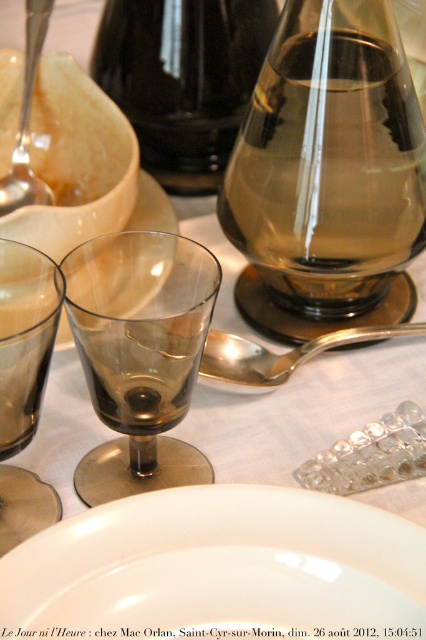
Is amber glass wine glass at center positioned behind white glossy platter at center?

Yes, amber glass wine glass at center is behind white glossy platter at center.

Does point (333, 42) come farther from viewer compared to point (273, 564)?

Yes, point (333, 42) is behind point (273, 564).

Is point (290, 3) in front of point (267, 496)?

No, (290, 3) is further to viewer.

You are a GUI agent. You are given a task and a screenshot of the screen. Output one action in this format:
    pyautogui.click(x=<x>, y=<y>)
    Task: Click on the amber glass wine glass at center
    
    Given the screenshot: What is the action you would take?
    pyautogui.click(x=328, y=173)

Does amber glass wine glass at center appear on the left side of brown glass at center?

Incorrect, amber glass wine glass at center is not on the left side of brown glass at center.

Is the position of amber glass wine glass at center more distant than that of brown glass at center?

Yes.

At what (x,y) coordinates should I click in order to perform the action: click on amber glass wine glass at center. Please return your answer as a coordinate pair (x, y). Image resolution: width=426 pixels, height=640 pixels. Looking at the image, I should click on (328, 173).

Does white glossy platter at center have a greater height compared to transparent glass at center?

In fact, white glossy platter at center may be shorter than transparent glass at center.

Is point (391, 577) positioned after point (16, 230)?

No.

Between point (362, 506) and point (71, 237), which one is positioned in front?

Point (362, 506) is more forward.

This screenshot has width=426, height=640. What are the coordinates of `white glossy platter at center` in the screenshot? It's located at (221, 566).